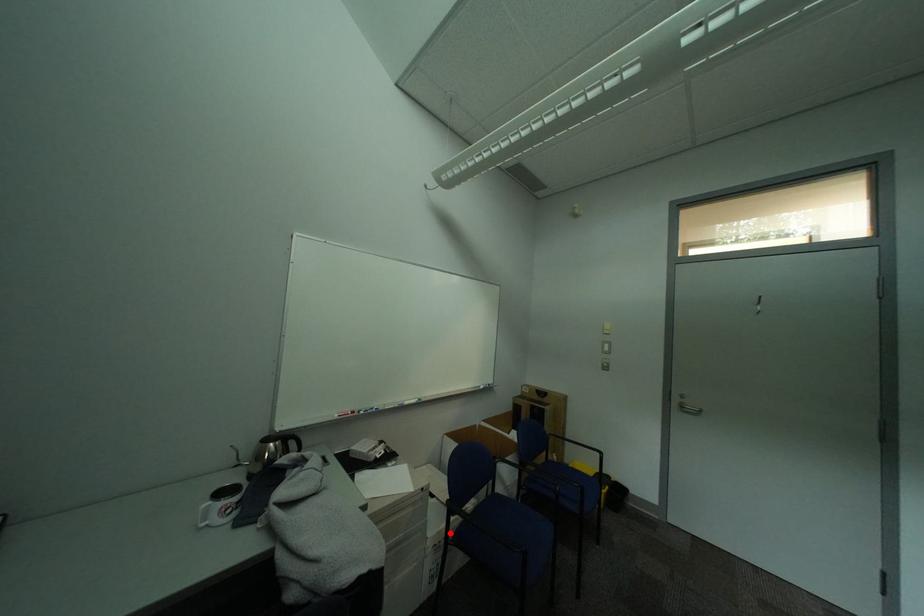
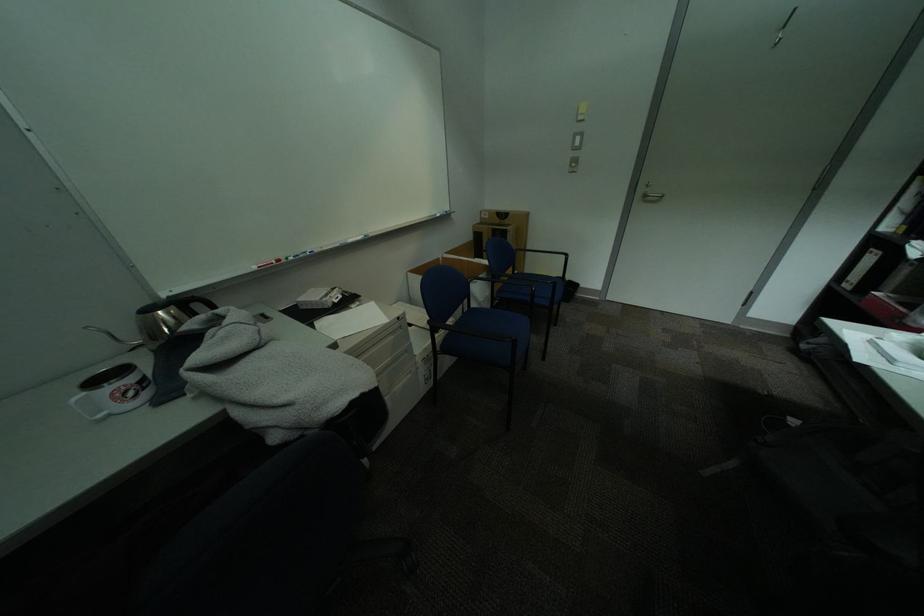
Question: I am providing you with two images of the same scene from different viewpoints. Given a red point in image1, look at the same physical point in image2. Is it:

Choices:
 (A) Closer to the viewpoint
 (B) Farther from the viewpoint

Answer: (A)